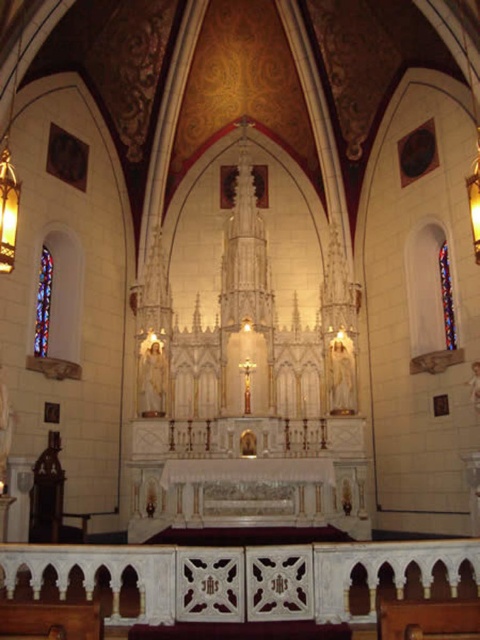
Question: Among these points, which one is farthest from the camera?

Choices:
 (A) click(39, 323)
 (B) click(451, 307)

Answer: (A)

Question: Which point is farther to the camera?

Choices:
 (A) (439, 264)
 (B) (44, 289)

Answer: (A)

Question: Where is stained glass window at left located in relation to stained glass window at right in the image?

Choices:
 (A) left
 (B) right

Answer: (A)

Question: Is stained glass window at left wider than stained glass window at right?

Choices:
 (A) no
 (B) yes

Answer: (B)

Question: Is stained glass window at left bigger than stained glass window at right?

Choices:
 (A) no
 (B) yes

Answer: (B)

Question: Which point is farther to the camera?

Choices:
 (A) (446, 337)
 (B) (40, 289)

Answer: (B)